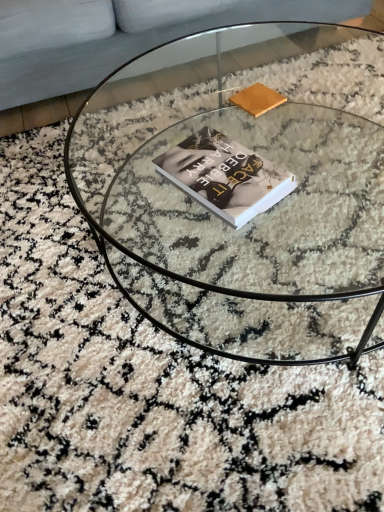
Where is `vacant space in between hardcover book at center and matte brown book at upper center`? vacant space in between hardcover book at center and matte brown book at upper center is located at coordinates (253, 133).